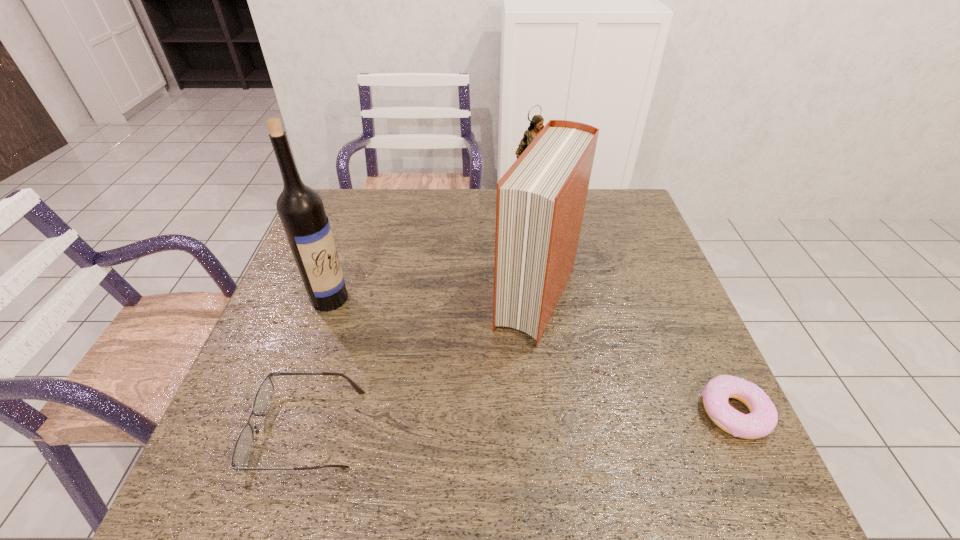
At what (x,y) coordinates should I click in order to perform the action: click on free location at the far right corner of the desktop. Please return your answer as a coordinate pair (x, y). Looking at the image, I should click on (628, 227).

Locate an element on the screen. The height and width of the screenshot is (540, 960). free space between the farthest object and the spectacles is located at coordinates (420, 319).

The height and width of the screenshot is (540, 960). Find the location of `free space that is in between the third shortest object and the doughnut`. free space that is in between the third shortest object and the doughnut is located at coordinates (633, 310).

This screenshot has width=960, height=540. What are the coordinates of `vacant region between the spectacles and the wine bottle` in the screenshot? It's located at (319, 363).

Where is `vacant space in between the rightmost object and the figurine`? vacant space in between the rightmost object and the figurine is located at coordinates 633,310.

Where is `vacant space in between the second tallest object and the doughnut`? vacant space in between the second tallest object and the doughnut is located at coordinates (635, 355).

The height and width of the screenshot is (540, 960). Identify the location of free space between the spectacles and the wine bottle. (319, 363).

This screenshot has height=540, width=960. I want to click on unoccupied position between the wine bottle and the doughnut, so click(x=532, y=355).

Image resolution: width=960 pixels, height=540 pixels. I want to click on free space between the third shortest object and the wine bottle, so click(431, 254).

This screenshot has width=960, height=540. Find the location of `free point between the second tallest object and the wine bottle`. free point between the second tallest object and the wine bottle is located at coordinates pyautogui.click(x=433, y=299).